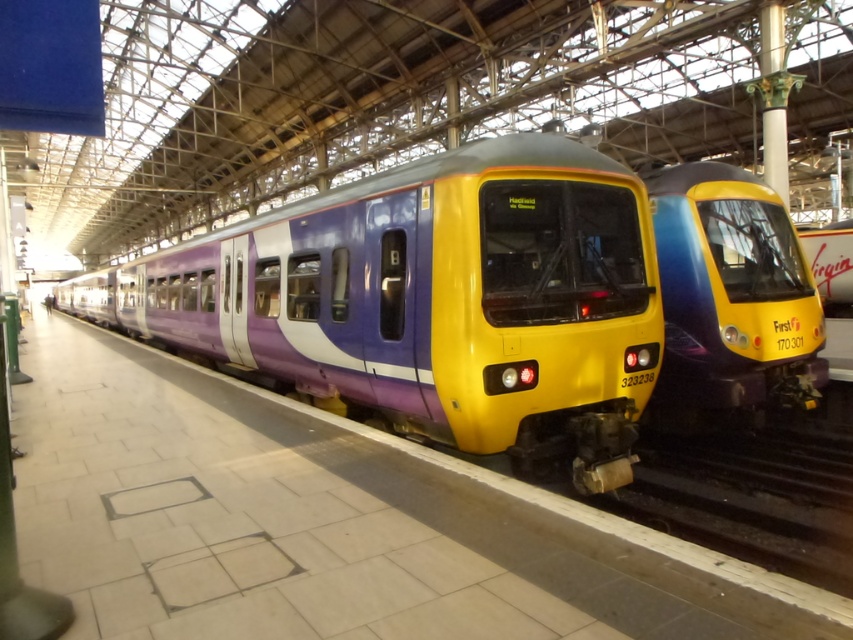
Between purple glossy train at center and yellow glossy train at center, which one appears on the left side from the viewer's perspective?

Positioned to the left is purple glossy train at center.

Is purple glossy train at center bigger than yellow glossy train at center?

Yes.

The height and width of the screenshot is (640, 853). In order to click on purple glossy train at center in this screenshot , I will do `click(433, 300)`.